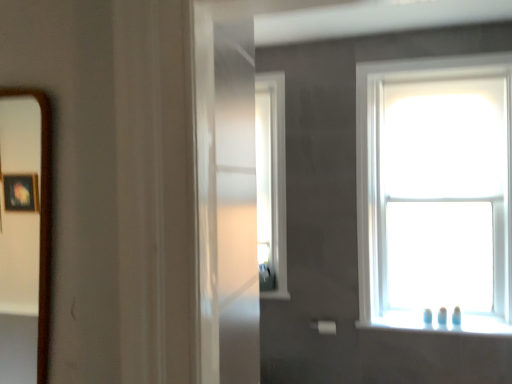
Question: Does white glossy window sill at lower right have a larger size compared to transparent glass window at upper right, positioned as the 1th window in right-to-left order?

Choices:
 (A) no
 (B) yes

Answer: (A)

Question: Can you confirm if white glossy window sill at lower right is thinner than transparent glass window at upper right, the second window in the left-to-right sequence?

Choices:
 (A) no
 (B) yes

Answer: (B)

Question: From a real-world perspective, does white glossy window sill at lower right stand above transparent glass window at upper right, positioned as the 1th window in right-to-left order?

Choices:
 (A) no
 (B) yes

Answer: (A)

Question: Does white glossy window sill at lower right come behind transparent glass window at upper right, positioned as the 1th window in right-to-left order?

Choices:
 (A) no
 (B) yes

Answer: (B)

Question: Considering the relative positions of white glossy window sill at lower right and transparent glass window at upper right, positioned as the 1th window in right-to-left order, in the image provided, is white glossy window sill at lower right to the right of transparent glass window at upper right, positioned as the 1th window in right-to-left order, from the viewer's perspective?

Choices:
 (A) no
 (B) yes

Answer: (A)

Question: Is white glossy window sill at lower right far away from transparent glass window at upper right, positioned as the 1th window in right-to-left order?

Choices:
 (A) no
 (B) yes

Answer: (A)

Question: Can you confirm if brown wooden mirror at left is taller than clear glass window at center, arranged as the 2th window when viewed from the right?

Choices:
 (A) yes
 (B) no

Answer: (B)

Question: Is brown wooden mirror at left oriented away from clear glass window at center, which ranks as the first window in left-to-right order?

Choices:
 (A) no
 (B) yes

Answer: (A)

Question: Can you confirm if brown wooden mirror at left is thinner than clear glass window at center, arranged as the 2th window when viewed from the right?

Choices:
 (A) no
 (B) yes

Answer: (B)

Question: Is brown wooden mirror at left not inside clear glass window at center, which ranks as the first window in left-to-right order?

Choices:
 (A) no
 (B) yes

Answer: (B)

Question: Can clear glass window at center, arranged as the 2th window when viewed from the right, be found inside brown wooden mirror at left?

Choices:
 (A) yes
 (B) no

Answer: (B)

Question: Is brown wooden mirror at left in front of clear glass window at center, which ranks as the first window in left-to-right order?

Choices:
 (A) yes
 (B) no

Answer: (A)

Question: Is clear glass window at center, arranged as the 2th window when viewed from the right, not within brown wooden mirror at left?

Choices:
 (A) yes
 (B) no

Answer: (A)